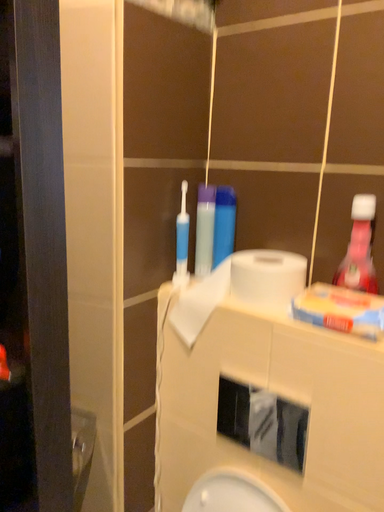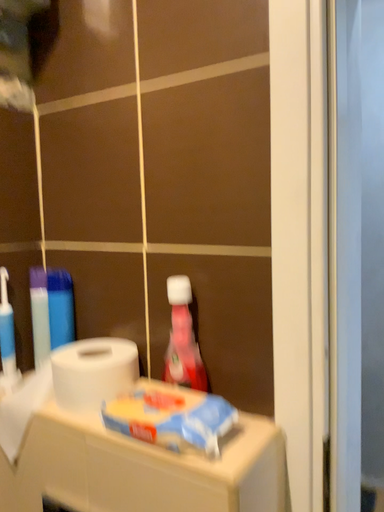
Question: Which way did the camera rotate in the video?

Choices:
 (A) rotated upward
 (B) rotated downward

Answer: (A)